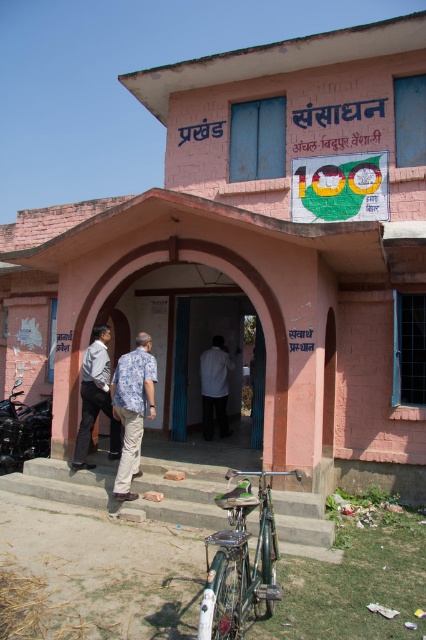
You are an architect analyzing the building layout. You see the blue floral shirt at center in the entrance. Can you determine if the shirt is closer to the entrance or the signboard above it based on their positions?

The blue floral shirt at center is positioned at point (132,408). Since the entrance is at the lower part and the signboard is above the entrance, the shirt is closer to the entrance than the signboard.

You are standing in front of the building and want to take a photo of both the shiny black motorcycle at lower left and the white fabric shirt at center. Which object should you focus on first to ensure both are in the frame?

You should focus on the shiny black motorcycle at lower left first since it is closer to the viewer than the white fabric shirt at center, ensuring both are in the frame.

You are a delivery person who needs to park your motorcycle. You see a shiny black motorcycle at lower left and a white fabric shirt at center. Which object is bigger and should you avoid parking near the smaller one to prevent blocking the entrance?

The shiny black motorcycle at lower left is larger in size than the white fabric shirt at center. You should avoid parking near the white fabric shirt at center since it is smaller and likely closer to the entrance.